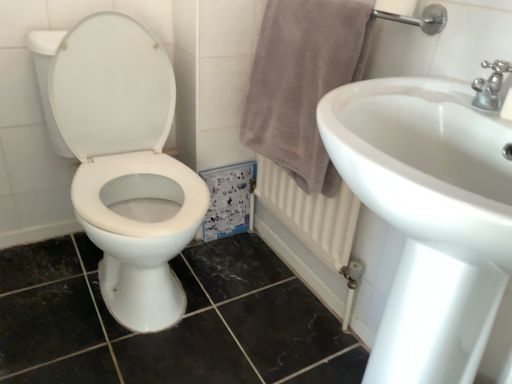
Find the location of a particular element. The image size is (512, 384). vacant area that is situated to the right of white glossy toilet at left is located at coordinates (251, 292).